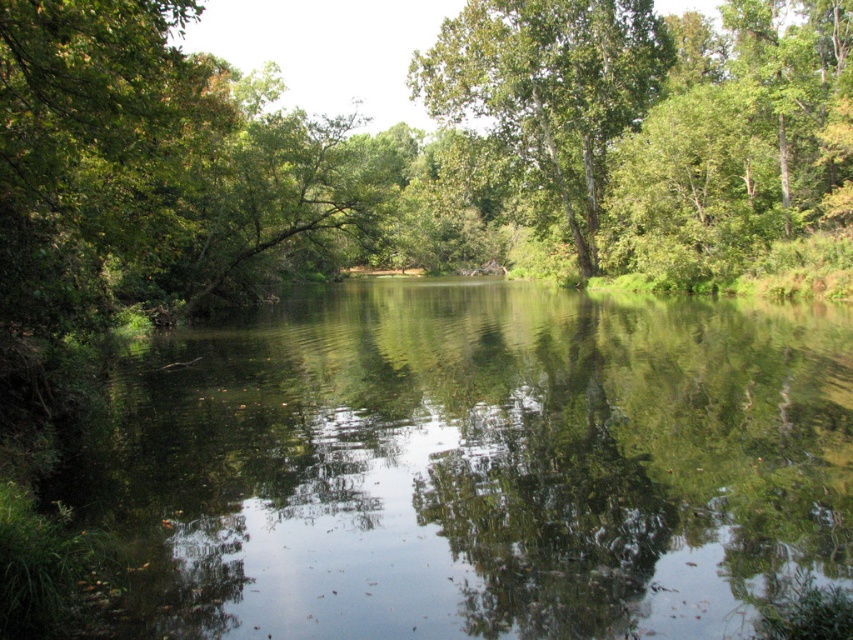
Question: Among these points, which one is farthest from the camera?

Choices:
 (A) (473, 307)
 (B) (579, 54)

Answer: (B)

Question: Is green reflective water at center smaller than green leafy tree at center?

Choices:
 (A) no
 (B) yes

Answer: (B)

Question: Considering the relative positions of green reflective water at center and green leafy tree at center in the image provided, where is green reflective water at center located with respect to green leafy tree at center?

Choices:
 (A) left
 (B) right

Answer: (A)

Question: Which of the following is the closest to the observer?

Choices:
 (A) green reflective water at center
 (B) green leafy tree at center

Answer: (A)

Question: Does green reflective water at center appear over green leafy tree at center?

Choices:
 (A) yes
 (B) no

Answer: (B)

Question: Which object appears farthest from the camera in this image?

Choices:
 (A) green leafy tree at center
 (B) green reflective water at center

Answer: (A)